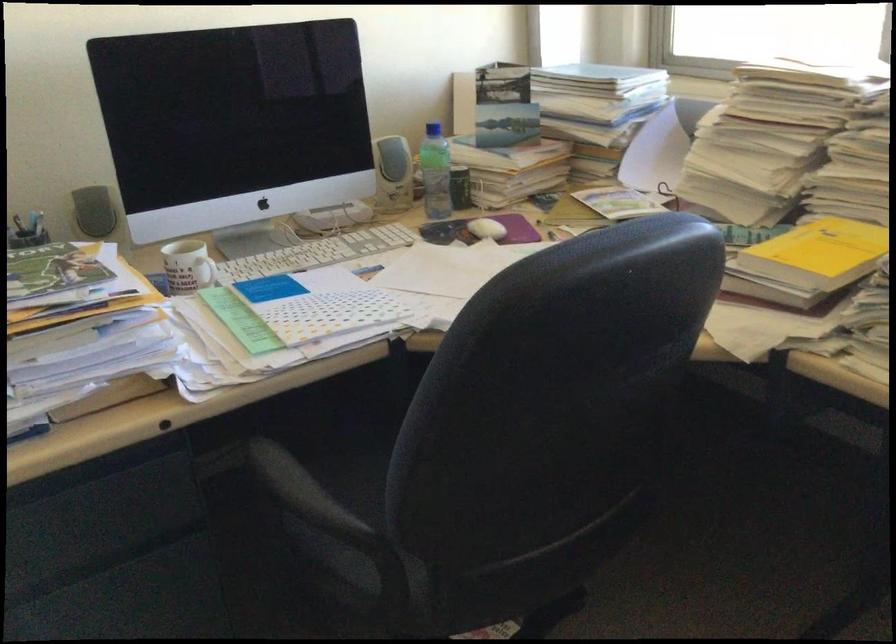
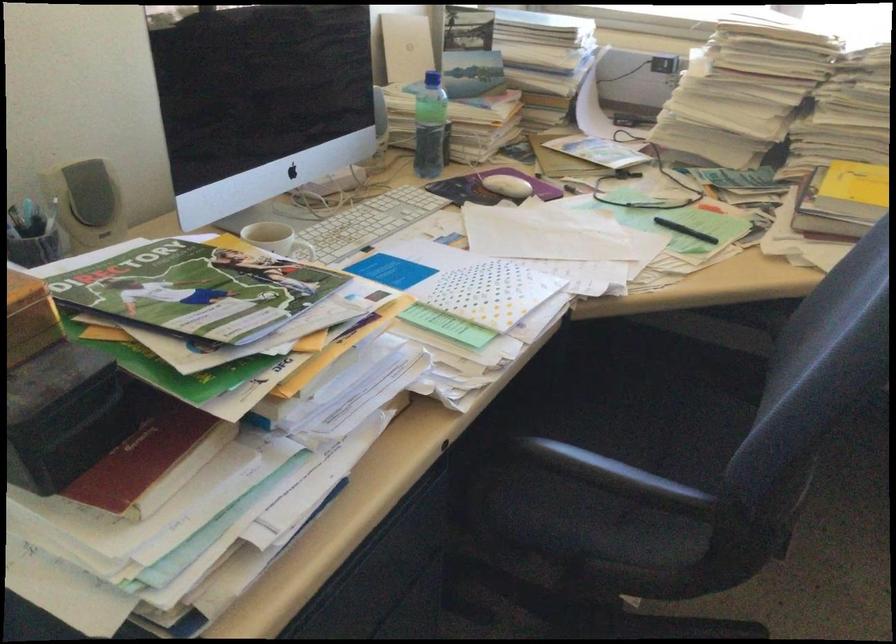
Where in the second image is the point corresponding to (472,228) from the first image?

(506, 185)